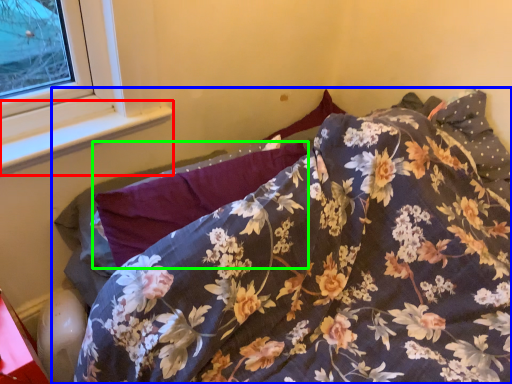
Question: Considering the real-world distances, which object is farthest from window sill (highlighted by a red box)? bed (highlighted by a blue box) or pillow (highlighted by a green box)?

Choices:
 (A) bed
 (B) pillow

Answer: (A)